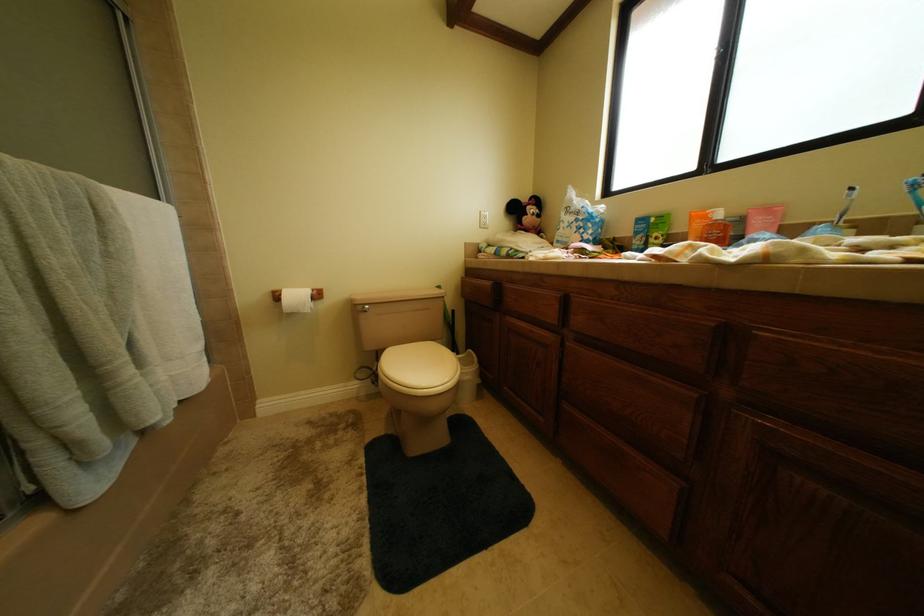
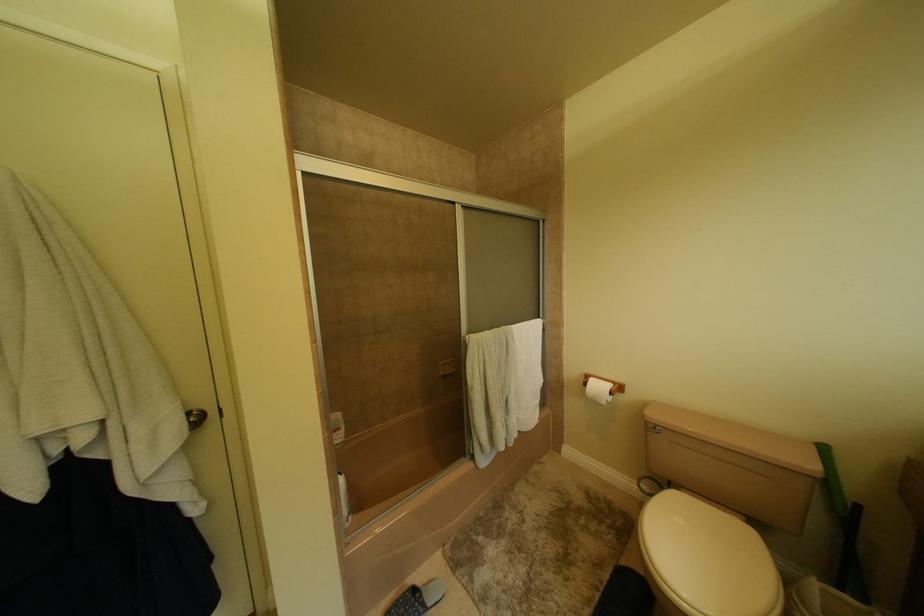
Question: The camera is either moving clockwise (left) or counter-clockwise (right) around the object. The first image is from the beginning of the video and the second image is from the end. Is the camera moving left or right when shooting the video?

Choices:
 (A) Left
 (B) Right

Answer: (B)